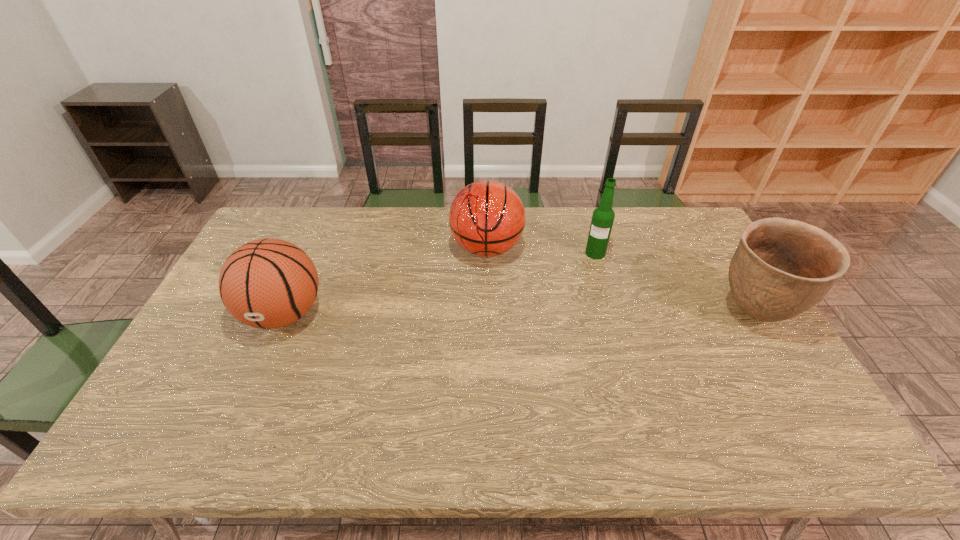
In order to click on vacant area at the left edge of the desktop in this screenshot , I will do `click(228, 340)`.

I want to click on vacant position at the right edge of the desktop, so click(x=700, y=306).

Image resolution: width=960 pixels, height=540 pixels. Find the location of `vacant region at the far right corner of the desktop`. vacant region at the far right corner of the desktop is located at coordinates (674, 208).

Image resolution: width=960 pixels, height=540 pixels. Identify the location of vacant space that is in between the beer bottle and the nearer basketball. (440, 284).

Where is `unoccupied position between the farther basketball and the nearer basketball`? unoccupied position between the farther basketball and the nearer basketball is located at coordinates [x=385, y=281].

Locate an element on the screen. The width and height of the screenshot is (960, 540). vacant space in between the rightmost object and the left basketball is located at coordinates (519, 314).

Identify the location of vacant area that lies between the farther basketball and the pottery. Image resolution: width=960 pixels, height=540 pixels. (621, 281).

Identify the location of blank region between the third object from right to left and the leftmost object. The height and width of the screenshot is (540, 960). (385, 281).

The height and width of the screenshot is (540, 960). What are the coordinates of `empty location between the beer bottle and the second object from left to right` in the screenshot? It's located at (541, 251).

You are a GUI agent. You are given a task and a screenshot of the screen. Output one action in this format:
    pyautogui.click(x=<x>, y=<y>)
    Task: Click on the free spot between the third object from right to left and the pottery
    The height and width of the screenshot is (540, 960).
    Given the screenshot: What is the action you would take?
    pyautogui.click(x=621, y=281)